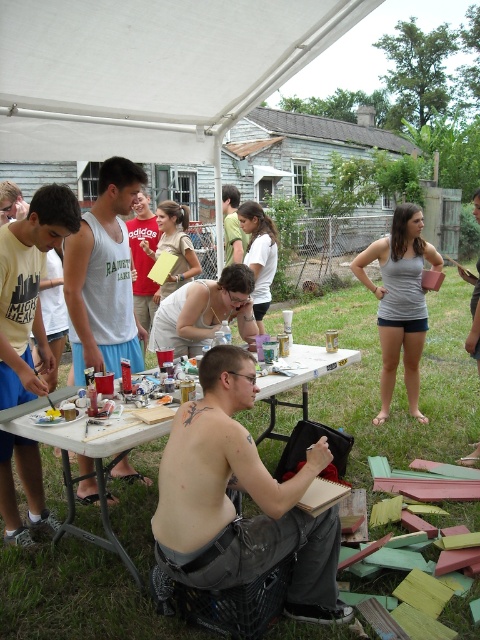
Is white tank top at center to the left of smooth white tank top at center from the viewer's perspective?

Indeed, white tank top at center is positioned on the left side of smooth white tank top at center.

Who is more forward, (66, 246) or (228, 241)?

Point (66, 246)

Where is `white tank top at center`? white tank top at center is located at coordinates 104,275.

Is white tank top at center to the right of white plastic table at center from the viewer's perspective?

Correct, you'll find white tank top at center to the right of white plastic table at center.

Is point (107, 308) more distant than point (127, 566)?

Yes.

Locate an element on the screen. white tank top at center is located at coordinates (104, 275).

Who is lower down, matte white tank top at left or white tank top at center?

matte white tank top at left is lower down.

Does matte white tank top at left appear on the right side of white tank top at center?

Incorrect, matte white tank top at left is not on the right side of white tank top at center.

Locate an element on the screen. The image size is (480, 640). matte white tank top at left is located at coordinates (28, 289).

Where is `matte white tank top at left`? matte white tank top at left is located at coordinates (28, 289).